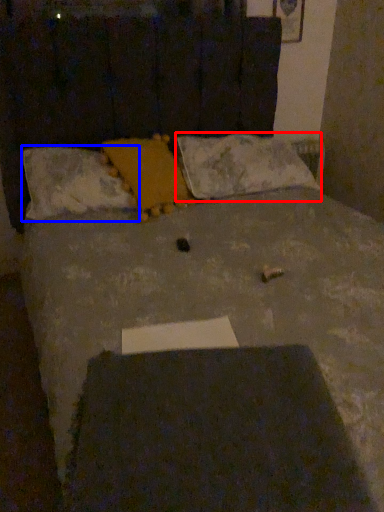
Question: Which object appears closest to the camera in this image, pillow (highlighted by a red box) or pillow (highlighted by a blue box)?

Choices:
 (A) pillow
 (B) pillow

Answer: (B)